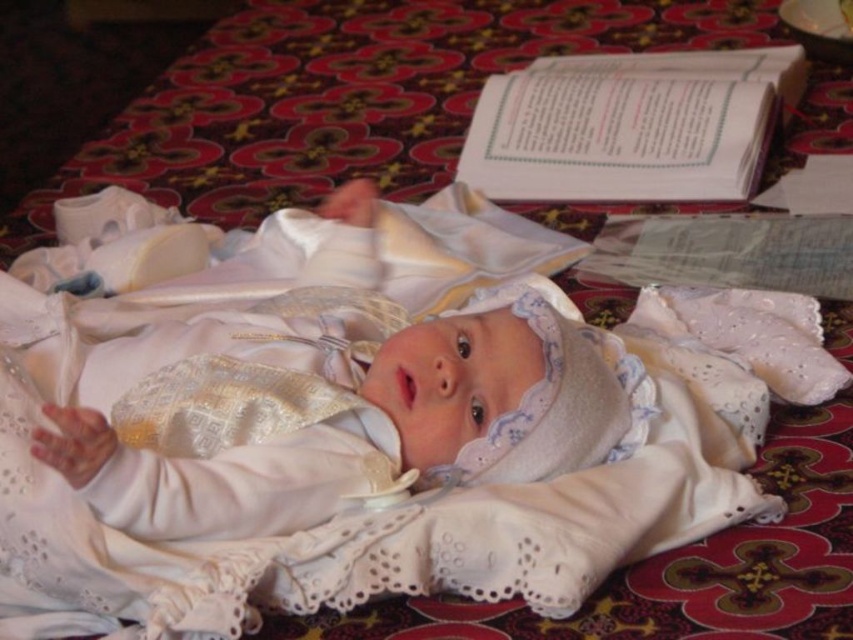
Based on the photo, can you confirm if white lace cloth at center is taller than white satin baby at center?

Yes, white lace cloth at center is taller than white satin baby at center.

Which is in front, point (718, 301) or point (445, 360)?

Point (445, 360)

Where is `white lace cloth at center`? This screenshot has height=640, width=853. white lace cloth at center is located at coordinates (357, 419).